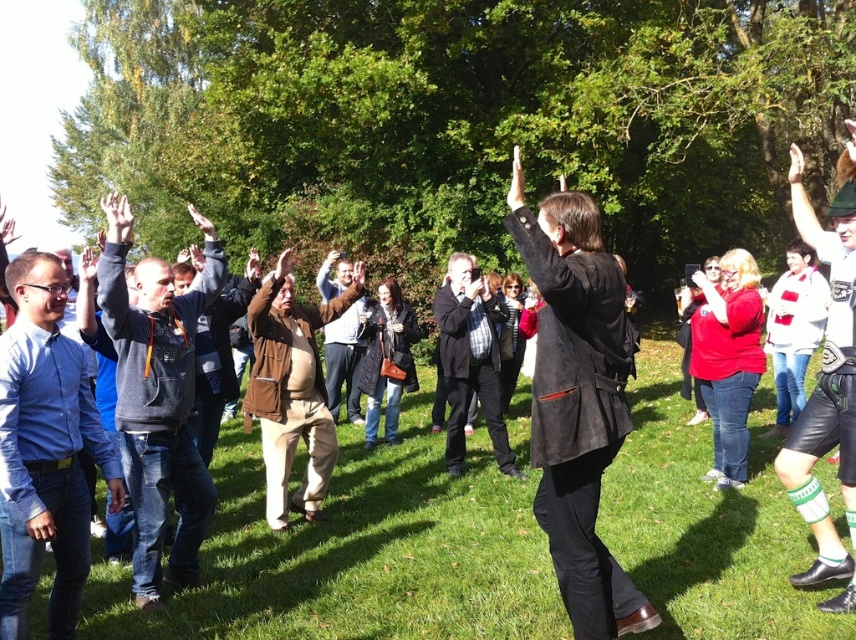
Is point (586, 291) positioned in front of point (156, 451)?

Yes.

Is matte black jacket at center in front of dark gray hoodie at left?

That is True.

Measure the distance between matte black jacket at center and camera.

matte black jacket at center is 9.51 feet from camera.

Image resolution: width=856 pixels, height=640 pixels. I want to click on matte black jacket at center, so click(577, 401).

Can you confirm if brown leather jacket at center is taller than plaid fabric shirt at center?

Incorrect, brown leather jacket at center's height is not larger of plaid fabric shirt at center's.

Does point (265, 289) come in front of point (444, 339)?

That is True.

Is point (296, 384) positioned after point (494, 332)?

No, it is not.

Identify the location of brown leather jacket at center. The image size is (856, 640). (292, 388).

Can you confirm if dark gray hoodie at left is smaller than plaid fabric shirt at center?

Yes.

Who is shorter, dark gray hoodie at left or plaid fabric shirt at center?

Standing shorter between the two is plaid fabric shirt at center.

Who is more distant from viewer, (129, 467) or (488, 408)?

Positioned behind is point (488, 408).

This screenshot has width=856, height=640. Identify the location of dark gray hoodie at left. coord(158,397).